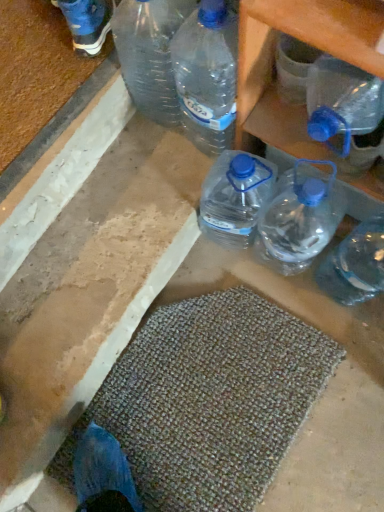
Question: From the image's perspective, is transparent plastic bottle at right, the second bottle in the front-to-back sequence, located above transparent plastic bottle at upper right, which is the 1th bottle in front-to-back order?

Choices:
 (A) yes
 (B) no

Answer: (B)

Question: Are transparent plastic bottle at right, the second bottle in the front-to-back sequence, and transparent plastic bottle at upper right, which is the 1th bottle in front-to-back order, beside each other?

Choices:
 (A) no
 (B) yes

Answer: (A)

Question: Is transparent plastic bottle at right, the second bottle in the front-to-back sequence, smaller than transparent plastic bottle at upper right, which is the 1th bottle in front-to-back order?

Choices:
 (A) no
 (B) yes

Answer: (B)

Question: Is transparent plastic bottle at right, the second bottle in the front-to-back sequence, located outside transparent plastic bottle at upper right, which is the 1th bottle in front-to-back order?

Choices:
 (A) yes
 (B) no

Answer: (A)

Question: Could you tell me if transparent plastic bottle at right, the second bottle in the front-to-back sequence, is turned towards transparent plastic bottle at upper right, the second bottle in the back-to-front sequence?

Choices:
 (A) yes
 (B) no

Answer: (B)

Question: Does point (374, 64) appear closer or farther from the camera than point (355, 86)?

Choices:
 (A) farther
 (B) closer

Answer: (B)

Question: From the image's perspective, is transparent plastic bottles at upper right located above or below transparent plastic bottle at upper right, the second bottle in the back-to-front sequence?

Choices:
 (A) below
 (B) above

Answer: (B)

Question: In the image, is transparent plastic bottles at upper right positioned in front of or behind transparent plastic bottle at upper right, the second bottle in the back-to-front sequence?

Choices:
 (A) behind
 (B) front

Answer: (A)

Question: From a real-world perspective, relative to transparent plastic bottle at upper right, which is the 1th bottle in front-to-back order, is transparent plastic bottles at upper right vertically above or below?

Choices:
 (A) below
 (B) above

Answer: (A)

Question: Is transparent plastic bottle at upper right, the second bottle in the back-to-front sequence, taller or shorter than textured beige bath mat at lower center?

Choices:
 (A) tall
 (B) short

Answer: (A)

Question: From the image's perspective, relative to textured beige bath mat at lower center, is transparent plastic bottle at upper right, which is the 1th bottle in front-to-back order, above or below?

Choices:
 (A) above
 (B) below

Answer: (A)

Question: From a real-world perspective, is transparent plastic bottle at upper right, which is the 1th bottle in front-to-back order, positioned above or below textured beige bath mat at lower center?

Choices:
 (A) above
 (B) below

Answer: (A)

Question: Is transparent plastic bottle at upper right, the second bottle in the back-to-front sequence, bigger or smaller than textured beige bath mat at lower center?

Choices:
 (A) big
 (B) small

Answer: (A)

Question: From a real-world perspective, is textured beige bath mat at lower center above or below transparent plastic bottle at upper right, the second bottle in the back-to-front sequence?

Choices:
 (A) above
 (B) below

Answer: (B)

Question: Based on their positions, is textured beige bath mat at lower center located to the left or right of transparent plastic bottle at upper right, the second bottle in the back-to-front sequence?

Choices:
 (A) right
 (B) left

Answer: (B)